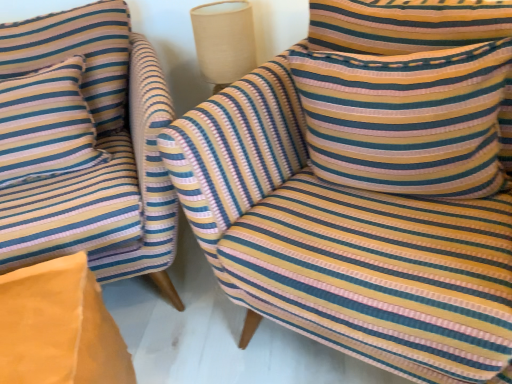
Question: Can you confirm if striped fabric pillow at left, which is counted as the 2th pillow, starting from the right, is thinner than striped fabric pillow at upper right, the second pillow in the left-to-right sequence?

Choices:
 (A) no
 (B) yes

Answer: (B)

Question: Would you say striped fabric pillow at upper right, marked as the first pillow in a right-to-left arrangement, is part of striped fabric pillow at left, which is counted as the 2th pillow, starting from the right,'s contents?

Choices:
 (A) yes
 (B) no

Answer: (B)

Question: Is striped fabric pillow at left, the first pillow viewed from the left, at the left side of striped fabric pillow at upper right, marked as the first pillow in a right-to-left arrangement?

Choices:
 (A) no
 (B) yes

Answer: (B)

Question: Would you say striped fabric pillow at left, which is counted as the 2th pillow, starting from the right, is a long distance from striped fabric pillow at upper right, the second pillow in the left-to-right sequence?

Choices:
 (A) no
 (B) yes

Answer: (A)

Question: Does striped fabric pillow at left, which is counted as the 2th pillow, starting from the right, come in front of striped fabric pillow at upper right, marked as the first pillow in a right-to-left arrangement?

Choices:
 (A) yes
 (B) no

Answer: (B)

Question: From their relative heights in the image, would you say striped fabric chair at left, which is the 2th chair from right to left, is taller or shorter than striped fabric pillow at left, which is counted as the 2th pillow, starting from the right?

Choices:
 (A) tall
 (B) short

Answer: (A)

Question: Considering the positions of striped fabric chair at left, which is the 2th chair from right to left, and striped fabric pillow at left, the first pillow viewed from the left, in the image, is striped fabric chair at left, which is the 2th chair from right to left, wider or thinner than striped fabric pillow at left, the first pillow viewed from the left,?

Choices:
 (A) wide
 (B) thin

Answer: (A)

Question: Is striped fabric chair at left, which is the 2th chair from right to left, inside the boundaries of striped fabric pillow at left, the first pillow viewed from the left, or outside?

Choices:
 (A) outside
 (B) inside

Answer: (A)

Question: From a real-world perspective, is striped fabric chair at left, the first chair positioned from the left, physically located above or below striped fabric pillow at left, which is counted as the 2th pillow, starting from the right?

Choices:
 (A) below
 (B) above

Answer: (A)

Question: Considering the positions of striped fabric pillow at left, which is counted as the 2th pillow, starting from the right, and striped fabric pillow at upper right, the second pillow in the left-to-right sequence, in the image, is striped fabric pillow at left, which is counted as the 2th pillow, starting from the right, taller or shorter than striped fabric pillow at upper right, the second pillow in the left-to-right sequence,?

Choices:
 (A) short
 (B) tall

Answer: (B)

Question: From the image's perspective, is striped fabric pillow at left, which is counted as the 2th pillow, starting from the right, located above or below striped fabric pillow at upper right, marked as the first pillow in a right-to-left arrangement?

Choices:
 (A) below
 (B) above

Answer: (B)

Question: Considering the positions of striped fabric pillow at left, which is counted as the 2th pillow, starting from the right, and striped fabric pillow at upper right, marked as the first pillow in a right-to-left arrangement, in the image, is striped fabric pillow at left, which is counted as the 2th pillow, starting from the right, wider or thinner than striped fabric pillow at upper right, marked as the first pillow in a right-to-left arrangement,?

Choices:
 (A) thin
 (B) wide

Answer: (A)

Question: Considering the relative positions of striped fabric pillow at left, the first pillow viewed from the left, and striped fabric pillow at upper right, the second pillow in the left-to-right sequence, in the image provided, is striped fabric pillow at left, the first pillow viewed from the left, to the left or to the right of striped fabric pillow at upper right, the second pillow in the left-to-right sequence,?

Choices:
 (A) left
 (B) right

Answer: (A)

Question: In terms of size, does striped fabric chair at left, the first chair positioned from the left, appear bigger or smaller than beige fabric lampshade at upper center?

Choices:
 (A) small
 (B) big

Answer: (B)

Question: Is point (118, 64) closer or farther from the camera than point (215, 28)?

Choices:
 (A) farther
 (B) closer

Answer: (A)